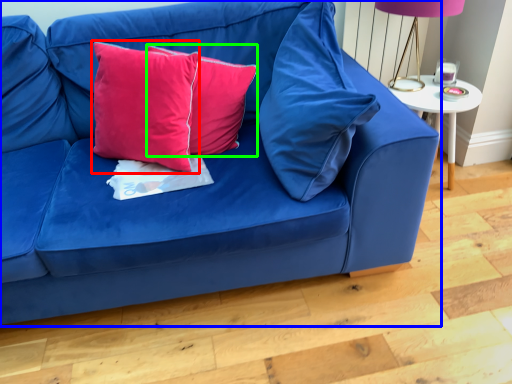
Question: Which object is the farthest from pillow (highlighted by a red box)? Choose among these: studio couch (highlighted by a blue box) or pillow (highlighted by a green box).

Choices:
 (A) studio couch
 (B) pillow

Answer: (A)